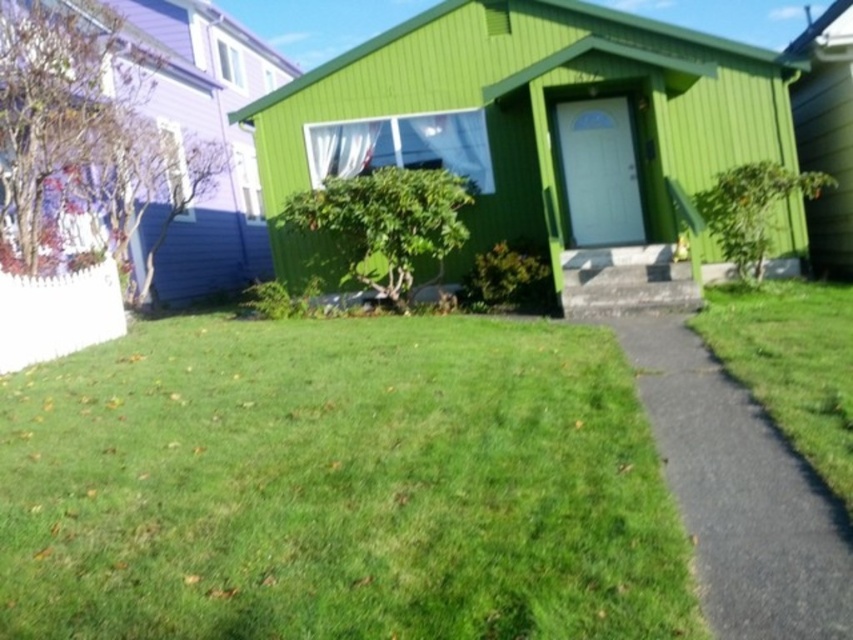
You are a gardener who wants to mow the lawn. You have a lawnmower that is 1.2 meters wide. Can you mow the green grass at center without crossing the black asphalt driveway at lower right?

The green grass at center might be wider than black asphalt driveway at lower right. Since the lawnmower is 1.2 meters wide, it depends on the actual width of the green grass at center. If it is indeed wider than the driveway, then yes, the lawnmower can fit without crossing over.

You are standing at the entrance of the vibrant green house and want to place a new flower pot between the two points labeled point [445,348] and point [752,541]. Which point is closer to you so you can place the flower pot there?

Point [445,348] is closer to you than point [752,541], so you should place the flower pot near point [445,348].